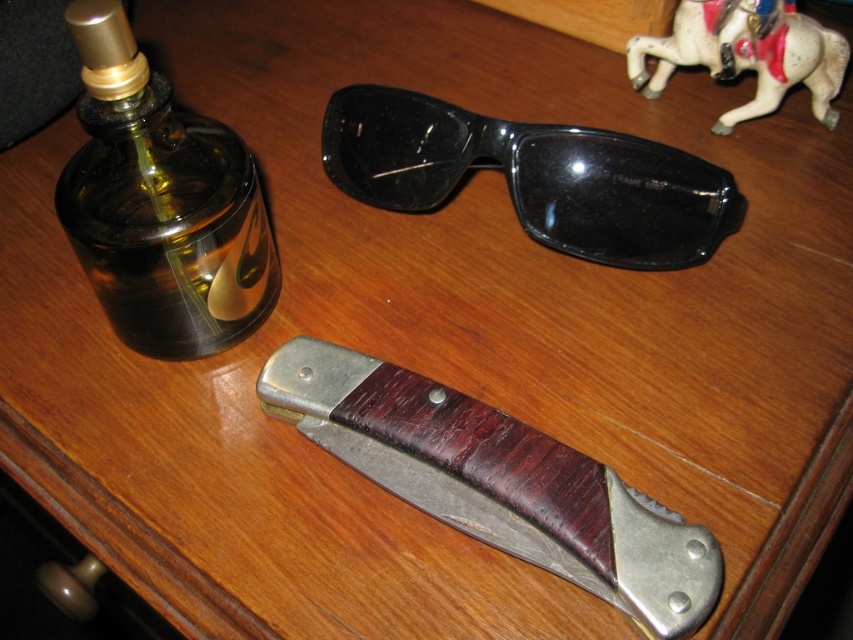
Question: Is green glass bottle at left smaller than metallic horse at upper right?

Choices:
 (A) no
 (B) yes

Answer: (A)

Question: Which object appears farthest from the camera in this image?

Choices:
 (A) wooden-handled folding knife at center
 (B) metallic horse at upper right
 (C) green glass bottle at left
 (D) black plastic sunglasses at center

Answer: (B)

Question: Observing the image, what is the correct spatial positioning of green glass bottle at left in reference to metallic horse at upper right?

Choices:
 (A) above
 (B) below

Answer: (B)

Question: Which of the following is the closest to the observer?

Choices:
 (A) (109, 45)
 (B) (599, 188)
 (C) (410, 406)
 (D) (764, 84)

Answer: (A)

Question: Does wooden-handled folding knife at center have a lesser width compared to black plastic sunglasses at center?

Choices:
 (A) yes
 (B) no

Answer: (A)

Question: Which point is farther to the camera?

Choices:
 (A) metallic horse at upper right
 (B) black plastic sunglasses at center
 (C) wooden-handled folding knife at center

Answer: (A)